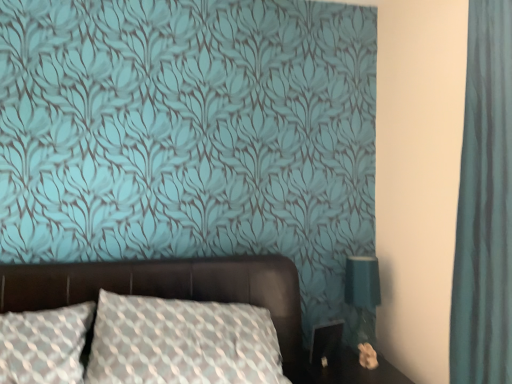
Locate an element on the screen. The image size is (512, 384). free space above teal fabric lampshade at right (from a real-world perspective) is located at coordinates (360, 264).